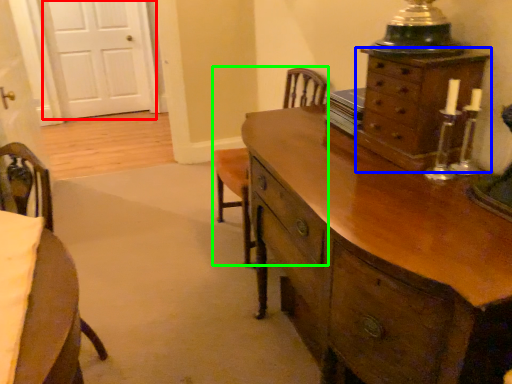
Question: Estimate the real-world distances between objects in this image. Which object is farther from door (highlighted by a red box), chest of drawers (highlighted by a blue box) or armchair (highlighted by a green box)?

Choices:
 (A) chest of drawers
 (B) armchair

Answer: (A)